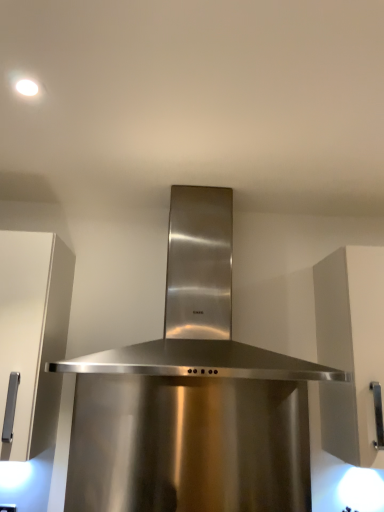
Question: Based on their positions, is stainless steel range hood at center located to the left or right of white matte cabinet at right?

Choices:
 (A) left
 (B) right

Answer: (A)

Question: Considering the positions of stainless steel range hood at center and white matte cabinet at right in the image, is stainless steel range hood at center taller or shorter than white matte cabinet at right?

Choices:
 (A) short
 (B) tall

Answer: (A)

Question: Considering the positions of stainless steel range hood at center and white matte cabinet at right in the image, is stainless steel range hood at center bigger or smaller than white matte cabinet at right?

Choices:
 (A) small
 (B) big

Answer: (B)

Question: From the image's perspective, is white matte cabinet at right above or below stainless steel range hood at center?

Choices:
 (A) below
 (B) above

Answer: (A)

Question: Considering the positions of white matte cabinet at right and stainless steel range hood at center in the image, is white matte cabinet at right wider or thinner than stainless steel range hood at center?

Choices:
 (A) thin
 (B) wide

Answer: (A)

Question: Looking at the image, does white matte cabinet at right seem bigger or smaller compared to stainless steel range hood at center?

Choices:
 (A) small
 (B) big

Answer: (A)

Question: Is white matte cabinet at right to the left or to the right of stainless steel range hood at center in the image?

Choices:
 (A) left
 (B) right

Answer: (B)